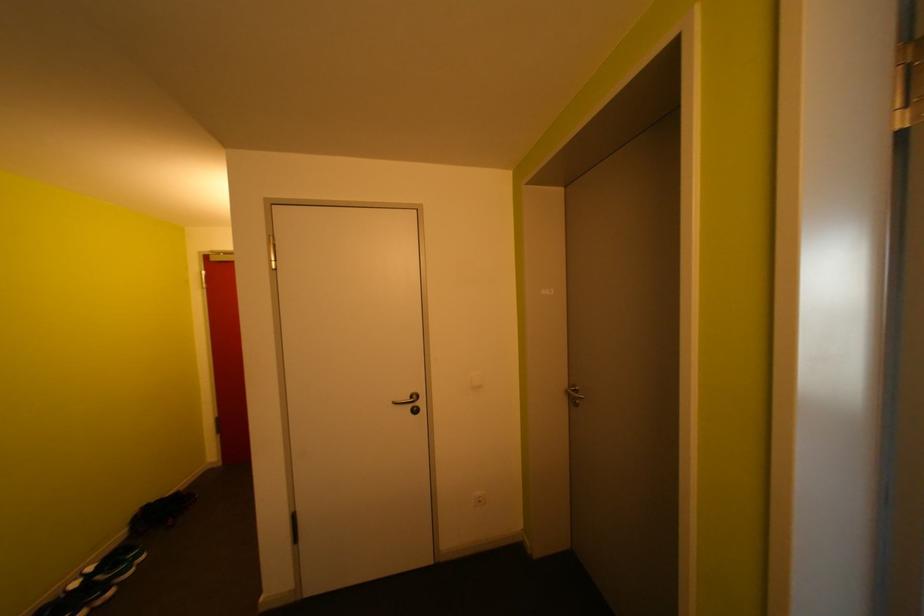
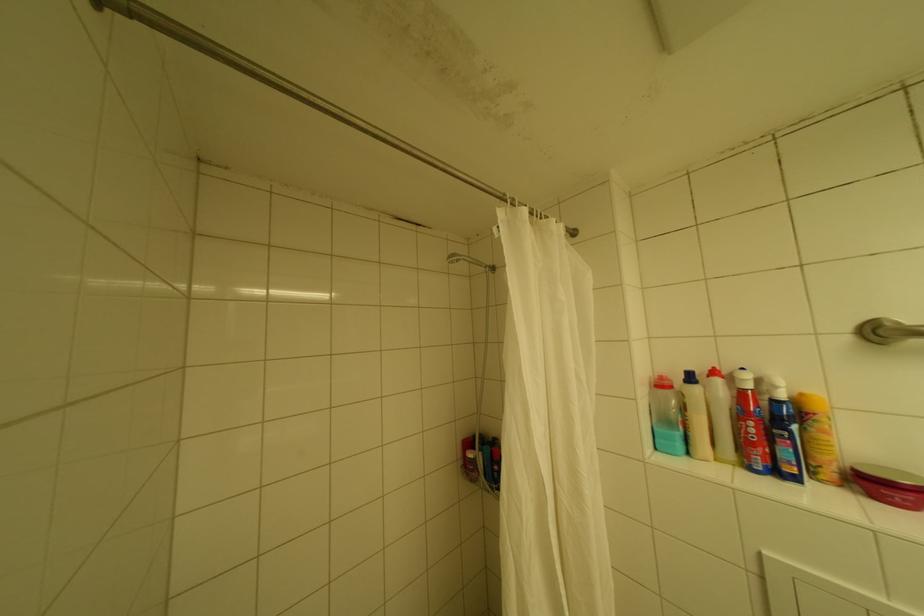
Question: Which direction would the cameraman need to move to produce the second image? Reply with the corresponding letter.

Choices:
 (A) Left
 (B) Right
 (C) Forward
 (D) Backward

Answer: (D)